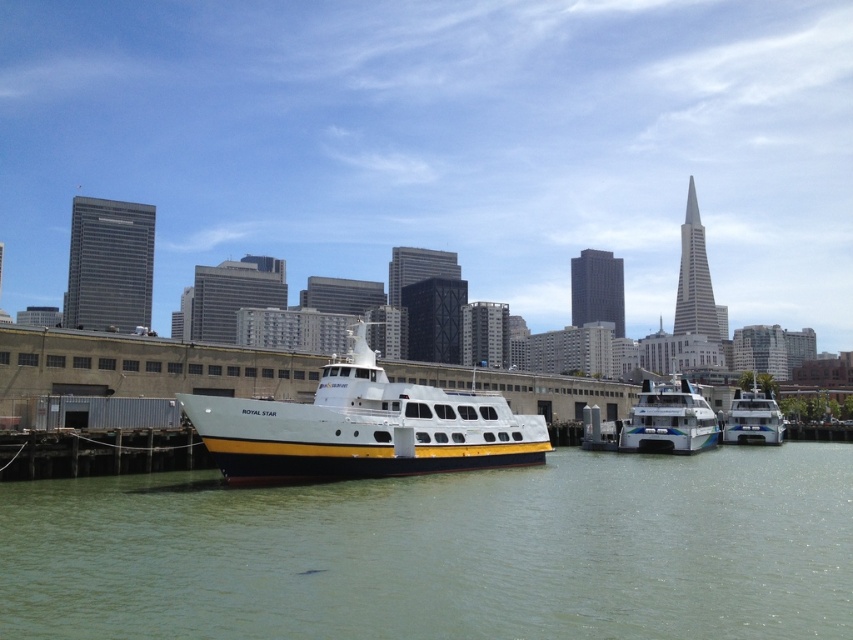
Question: Is green water at center closer to the viewer compared to white glossy ferry at center?

Choices:
 (A) no
 (B) yes

Answer: (B)

Question: Can you confirm if white matte ferry at center is smaller than white glossy ferry at center?

Choices:
 (A) no
 (B) yes

Answer: (A)

Question: Which point is farther to the camera?

Choices:
 (A) white glossy boat at center
 (B) green water at center

Answer: (A)

Question: Is white matte ferry at center to the right of white glossy ferry at center from the viewer's perspective?

Choices:
 (A) no
 (B) yes

Answer: (A)

Question: Which point is closer to the camera taking this photo?

Choices:
 (A) (325, 436)
 (B) (703, 406)
 (C) (770, 432)

Answer: (A)

Question: Among these points, which one is nearest to the camera?

Choices:
 (A) (645, 381)
 (B) (737, 436)
 (C) (299, 452)
 (D) (650, 500)

Answer: (D)